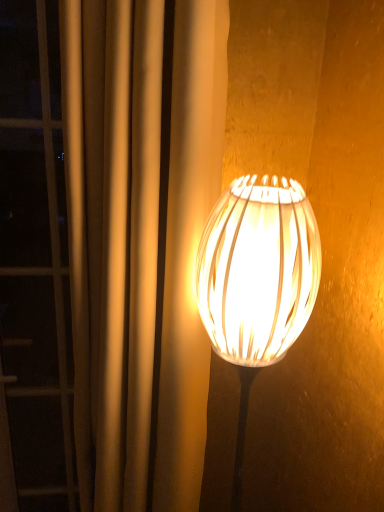
Question: Should I look upward or downward to see silky beige curtain at right?

Choices:
 (A) up
 (B) down

Answer: (B)

Question: Does translucent white lampshade at center have a greater width compared to silky beige curtain at right?

Choices:
 (A) no
 (B) yes

Answer: (A)

Question: From the image's perspective, is translucent white lampshade at center on top of silky beige curtain at right?

Choices:
 (A) no
 (B) yes

Answer: (A)

Question: From the image's perspective, is translucent white lampshade at center under silky beige curtain at right?

Choices:
 (A) yes
 (B) no

Answer: (A)

Question: Is translucent white lampshade at center completely or partially outside of silky beige curtain at right?

Choices:
 (A) yes
 (B) no

Answer: (A)

Question: Is translucent white lampshade at center oriented towards silky beige curtain at right?

Choices:
 (A) no
 (B) yes

Answer: (A)

Question: Would you say translucent white lampshade at center contains silky beige curtain at right?

Choices:
 (A) no
 (B) yes

Answer: (A)

Question: From the image's perspective, is silky beige curtain at right located beneath translucent white lampshade at center?

Choices:
 (A) no
 (B) yes

Answer: (A)

Question: From the image's perspective, is silky beige curtain at right over translucent white lampshade at center?

Choices:
 (A) no
 (B) yes

Answer: (B)

Question: Considering the relative sizes of silky beige curtain at right and translucent white lampshade at center in the image provided, is silky beige curtain at right taller than translucent white lampshade at center?

Choices:
 (A) yes
 (B) no

Answer: (A)

Question: Is silky beige curtain at right bigger than translucent white lampshade at center?

Choices:
 (A) no
 (B) yes

Answer: (B)

Question: Is silky beige curtain at right not within translucent white lampshade at center?

Choices:
 (A) yes
 (B) no

Answer: (A)

Question: From a real-world perspective, is silky beige curtain at right physically above translucent white lampshade at center?

Choices:
 (A) yes
 (B) no

Answer: (B)

Question: In the image, is silky beige curtain at right on the left side or the right side of translucent white lampshade at center?

Choices:
 (A) right
 (B) left

Answer: (B)